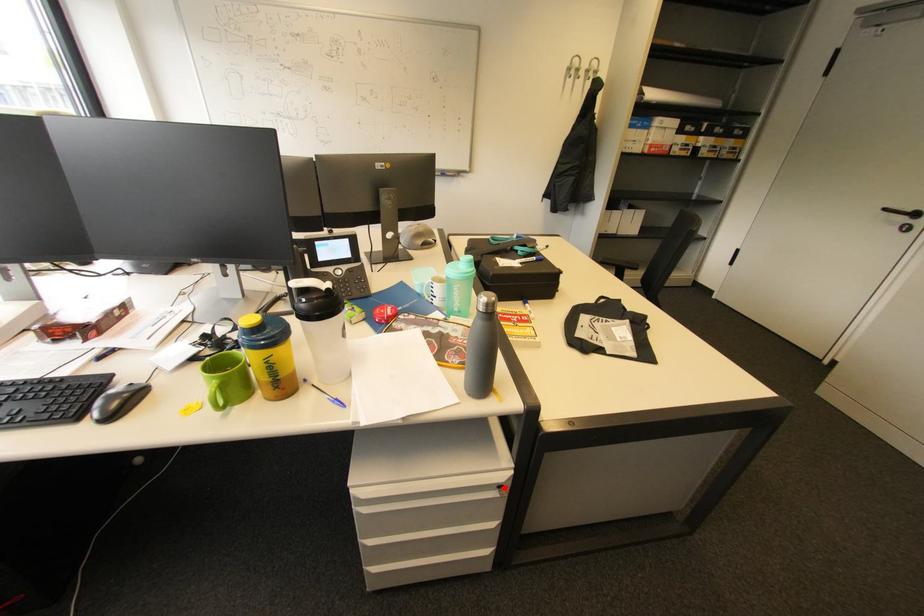
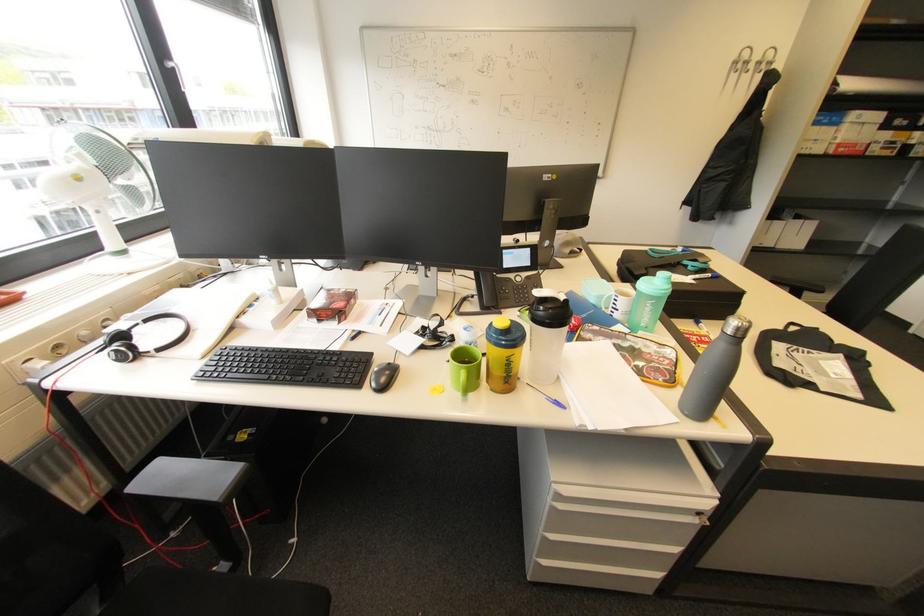
Find the pixel in the second image that matches the highlighted location in the first image.

(704, 514)